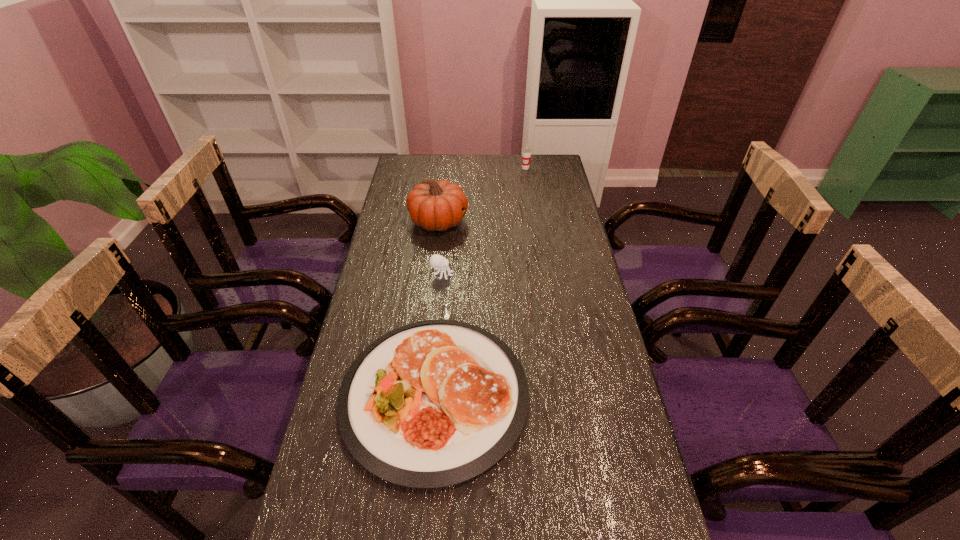
This screenshot has width=960, height=540. I want to click on the tallest object, so click(x=433, y=205).

This screenshot has height=540, width=960. I want to click on pumpkin, so click(x=433, y=205).

I want to click on cup, so click(526, 151).

I want to click on the third shortest object, so click(x=526, y=151).

I want to click on octopus, so click(437, 261).

The image size is (960, 540). Find the location of `the third tallest object`. the third tallest object is located at coordinates (437, 261).

The image size is (960, 540). I want to click on the shortest object, so click(433, 403).

At what (x,y) coordinates should I click in order to perform the action: click on dish. Please return your answer as a coordinate pair (x, y). This screenshot has width=960, height=540. Looking at the image, I should click on (433, 403).

The width and height of the screenshot is (960, 540). Identify the location of vacant space situated on the face of the tallest object. (568, 221).

Locate an element on the screen. The image size is (960, 540). vacant area situated 0.130m on the side of the rightmost object with the logo is located at coordinates (528, 186).